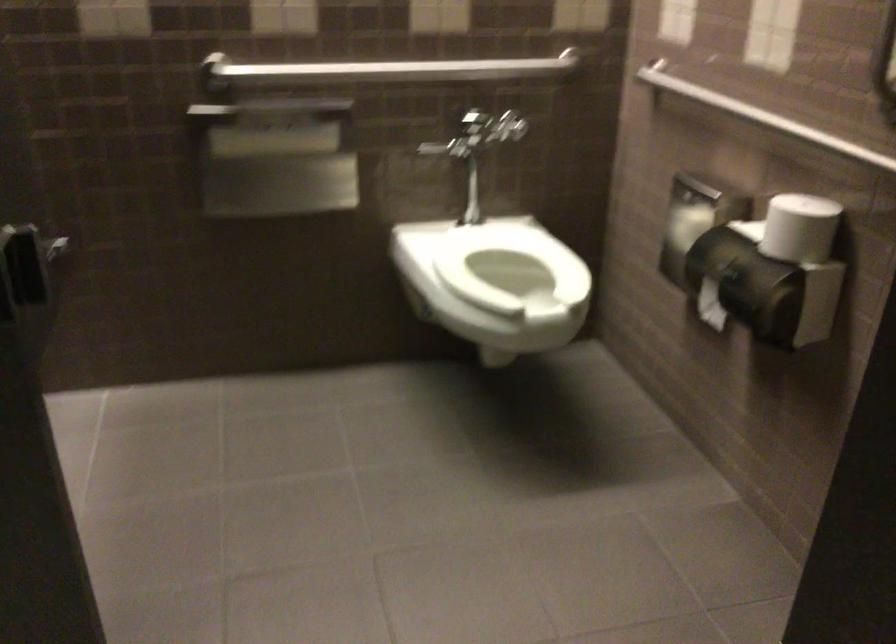
This screenshot has width=896, height=644. Identify the location of stall door handle. (26, 223).